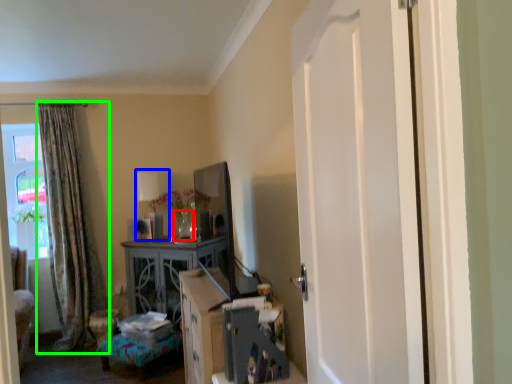
Question: Estimate the real-world distances between objects in this image. Which object is farther from vase (highlighted by a red box), lamp (highlighted by a blue box) or curtain (highlighted by a green box)?

Choices:
 (A) lamp
 (B) curtain

Answer: (B)